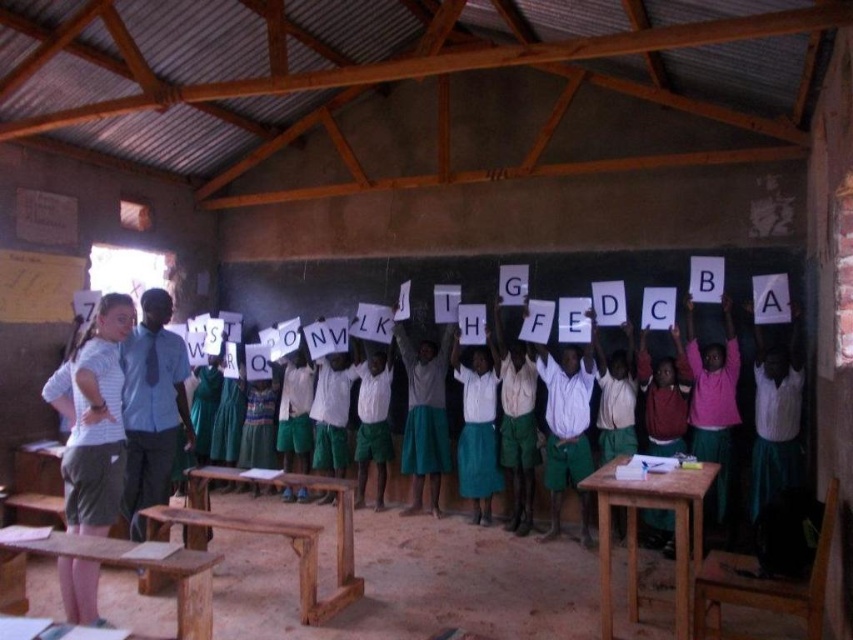
You are a photographer trying to capture a clear image of the white cotton shirt at center and the wooden table at center. Which object should you focus on first if you want to ensure both are in focus?

The white cotton shirt at center is thinner than the wooden table at center, so you should focus on the wooden table at center first to ensure both are in focus.

From the picture: You are a photographer standing in the classroom and want to take a photo of both point [490,365] and point [300,474]. Which point is closer to you?

Point [300,474] is closer to you because it is less further away than point [490,365].